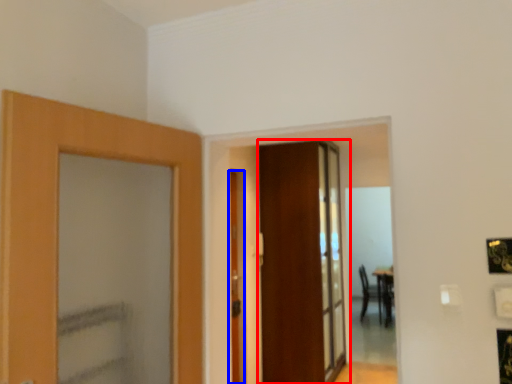
Question: Which object is closer to the camera taking this photo, door (highlighted by a red box) or door (highlighted by a blue box)?

Choices:
 (A) door
 (B) door

Answer: (B)